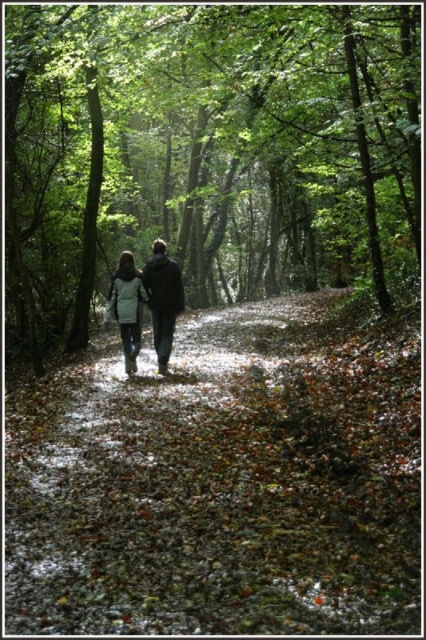
Question: Which object appears closest to the camera in this image?

Choices:
 (A) light gray fabric coat at center
 (B) brown leafy forest path at center
 (C) white wool coat at center
 (D) green leafy tree at center

Answer: (B)

Question: Which of the following is the farthest from the observer?

Choices:
 (A) (166, 280)
 (B) (129, 272)

Answer: (B)

Question: Observing the image, what is the correct spatial positioning of green leafy tree at center in reference to white wool coat at center?

Choices:
 (A) below
 (B) above

Answer: (B)

Question: Where is brown leafy forest path at center located in relation to light gray fabric coat at center in the image?

Choices:
 (A) above
 (B) below

Answer: (B)

Question: Which of the following is the farthest from the observer?

Choices:
 (A) (115, 291)
 (B) (155, 154)

Answer: (B)

Question: Does green leafy tree at center appear over white wool coat at center?

Choices:
 (A) yes
 (B) no

Answer: (A)